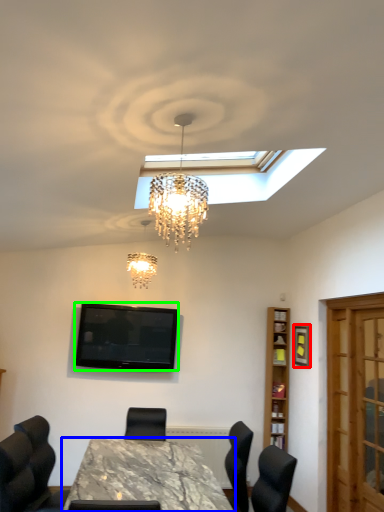
Question: Which object is positioned farthest from picture frame (highlighted by a red box)? Select from table (highlighted by a blue box) and television (highlighted by a green box).

Choices:
 (A) table
 (B) television

Answer: (A)